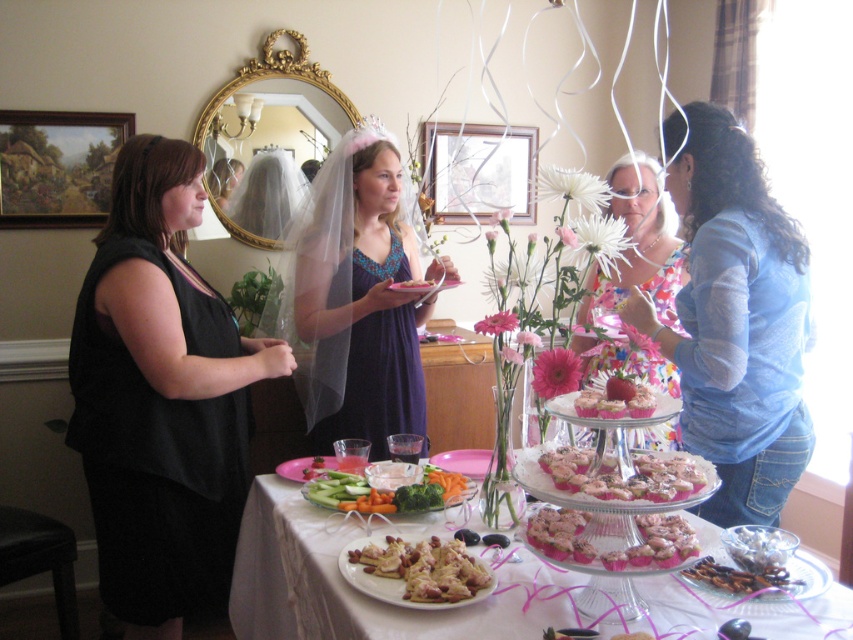
Question: Does white crumbly pastry at center come behind pink frosted cupcake at center?

Choices:
 (A) yes
 (B) no

Answer: (B)

Question: Can you confirm if white crumbly pastry at center is thinner than matte plastic cupcake at center?

Choices:
 (A) yes
 (B) no

Answer: (B)

Question: Among these points, which one is nearest to the camera?

Choices:
 (A) (424, 429)
 (B) (584, 397)
 (C) (645, 156)

Answer: (B)

Question: Which object is farther from the camera taking this photo?

Choices:
 (A) blue denim jeans at right
 (B) pink matte cupcakes at center
 (C) floral-patterned dress at center
 (D) black matte dress at left

Answer: (D)

Question: Which point is closer to the camera?

Choices:
 (A) floral-patterned dress at center
 (B) pink frosted cupcakes at center
 (C) fresh green vegetables at center

Answer: (B)

Question: Can you confirm if black matte dress at left is positioned above purple satin dress at center?

Choices:
 (A) no
 (B) yes

Answer: (A)